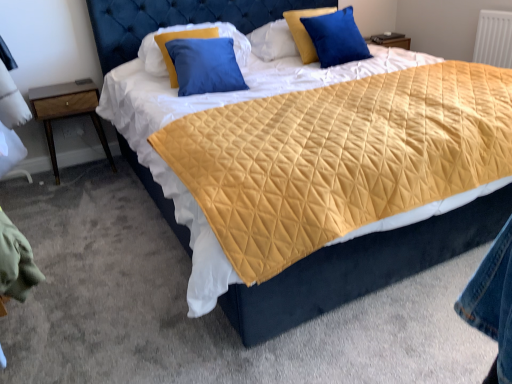
Question: Is wooden nightstand at left bigger than blue satin pillow at upper right, the third pillow positioned from the left?

Choices:
 (A) no
 (B) yes

Answer: (B)

Question: From the image's perspective, would you say wooden nightstand at left is positioned over blue satin pillow at upper right, the third pillow positioned from the left?

Choices:
 (A) no
 (B) yes

Answer: (A)

Question: Is wooden nightstand at left positioned beyond the bounds of blue satin pillow at upper right, which ranks as the 1th pillow in right-to-left order?

Choices:
 (A) no
 (B) yes

Answer: (B)

Question: Does wooden nightstand at left have a lesser width compared to blue satin pillow at upper right, the third pillow positioned from the left?

Choices:
 (A) no
 (B) yes

Answer: (A)

Question: Can you confirm if wooden nightstand at left is wider than blue satin pillow at upper right, which ranks as the 1th pillow in right-to-left order?

Choices:
 (A) yes
 (B) no

Answer: (A)

Question: Considering the positions of point (89, 110) and point (270, 49), is point (89, 110) closer or farther from the camera than point (270, 49)?

Choices:
 (A) farther
 (B) closer

Answer: (B)

Question: Visually, is wooden nightstand at left positioned to the left or to the right of velvet blue pillow at upper center, the 2th pillow positioned from the left?

Choices:
 (A) right
 (B) left

Answer: (B)

Question: From a real-world perspective, relative to velvet blue pillow at upper center, the second pillow viewed from the right, is wooden nightstand at left vertically above or below?

Choices:
 (A) below
 (B) above

Answer: (A)

Question: Is wooden nightstand at left in front of or behind velvet blue pillow at upper center, the second pillow viewed from the right, in the image?

Choices:
 (A) behind
 (B) front

Answer: (B)

Question: Visually, is wooden nightstand at left positioned to the left or to the right of blue satin pillow at upper right, the third pillow positioned from the left?

Choices:
 (A) left
 (B) right

Answer: (A)

Question: From a real-world perspective, is wooden nightstand at left positioned above or below blue satin pillow at upper right, the third pillow positioned from the left?

Choices:
 (A) above
 (B) below

Answer: (B)

Question: Is point (106, 144) closer or farther from the camera than point (310, 31)?

Choices:
 (A) farther
 (B) closer

Answer: (A)

Question: Is wooden nightstand at left spatially inside blue satin pillow at upper right, which ranks as the 1th pillow in right-to-left order, or outside of it?

Choices:
 (A) outside
 (B) inside

Answer: (A)

Question: Would you say blue satin pillow at upper right, the third pillow positioned from the left, is inside or outside wooden nightstand at left?

Choices:
 (A) inside
 (B) outside

Answer: (B)

Question: From the image's perspective, relative to wooden nightstand at left, is blue satin pillow at upper right, the third pillow positioned from the left, above or below?

Choices:
 (A) below
 (B) above

Answer: (B)